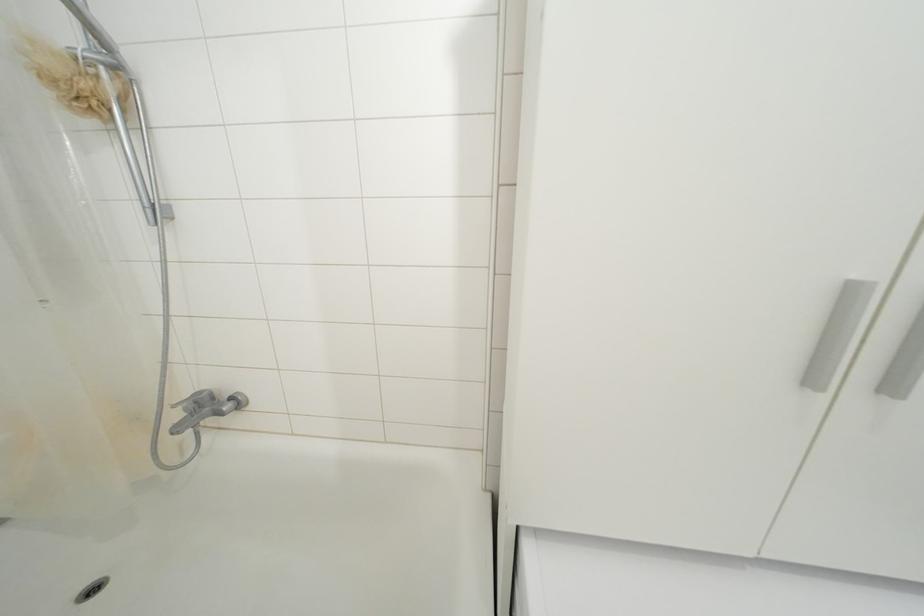
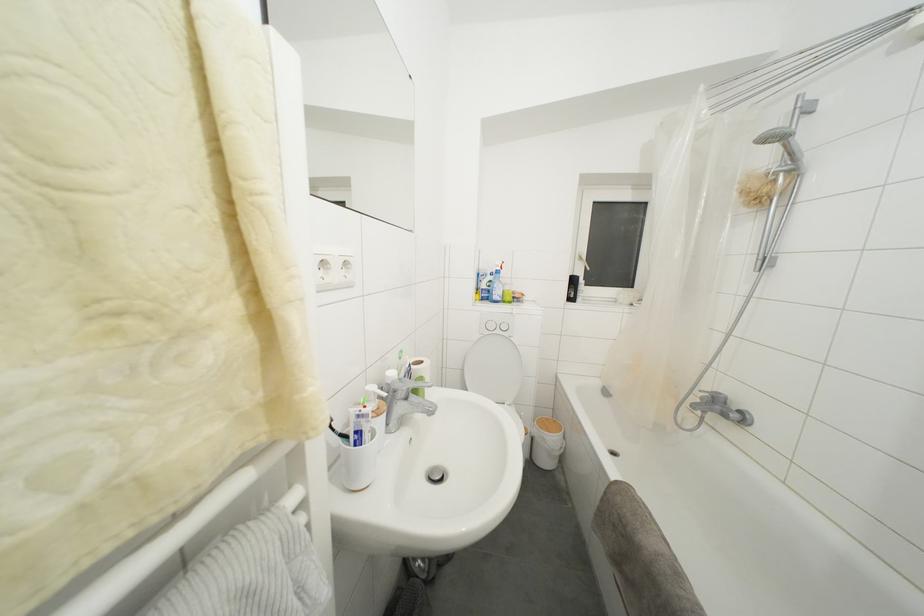
Question: Based on the continuous images, in which direction is the camera rotating? Reply with the corresponding letter.

Choices:
 (A) Left
 (B) Right
 (C) Up
 (D) Down

Answer: (A)